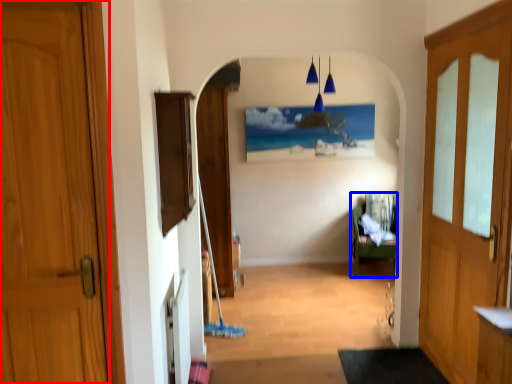
Question: Which object is closer to the camera taking this photo, door (highlighted by a red box) or furniture (highlighted by a blue box)?

Choices:
 (A) door
 (B) furniture

Answer: (A)